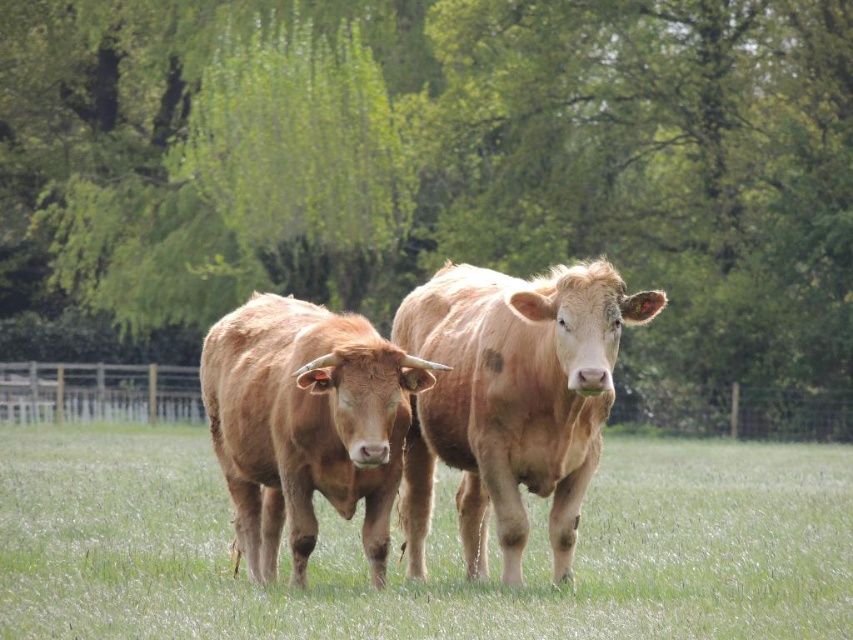
Question: Based on their relative distances, which object is farther from the green grass at center?

Choices:
 (A) green leafy tree at center
 (B) light brown textured cow at center
 (C) light brown smooth cow at center

Answer: (A)

Question: Is the position of light brown smooth cow at center less distant than that of light brown textured cow at center?

Choices:
 (A) yes
 (B) no

Answer: (A)

Question: Does green leafy tree at center have a greater width compared to green grass at center?

Choices:
 (A) no
 (B) yes

Answer: (B)

Question: Estimate the real-world distances between objects in this image. Which object is closer to the light brown textured cow at center?

Choices:
 (A) green grass at center
 (B) green leafy tree at center

Answer: (A)

Question: Among these objects, which one is nearest to the camera?

Choices:
 (A) light brown textured cow at center
 (B) light brown smooth cow at center

Answer: (B)

Question: Is the position of green leafy tree at center less distant than that of light brown smooth cow at center?

Choices:
 (A) no
 (B) yes

Answer: (A)